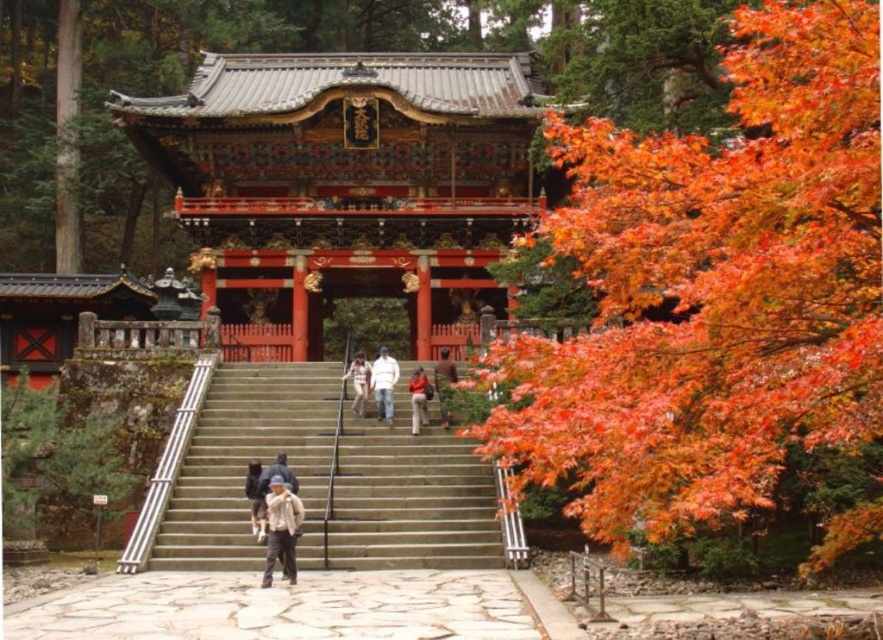
Can you confirm if stone stairs at center is positioned to the right of orange fabric jacket at center?

No, stone stairs at center is not to the right of orange fabric jacket at center.

Can you confirm if stone stairs at center is positioned above orange fabric jacket at center?

No.

Which is behind, point (304, 416) or point (416, 416)?

Point (304, 416)

Find the location of a particular element. The image size is (883, 640). stone stairs at center is located at coordinates (325, 481).

Does dark brown leather jacket at center appear over light brown leather jacket at center?

Indeed, dark brown leather jacket at center is positioned over light brown leather jacket at center.

Who is taller, dark brown leather jacket at center or light brown leather jacket at center?

With more height is dark brown leather jacket at center.

Is point (450, 397) positioned behind point (349, 372)?

That is False.

Find the location of a particular element. The width and height of the screenshot is (883, 640). dark brown leather jacket at center is located at coordinates (444, 385).

Does light beige fabric jacket at lower center appear on the right side of orange fabric jacket at center?

No, light beige fabric jacket at lower center is not to the right of orange fabric jacket at center.

Does point (281, 532) come closer to viewer compared to point (419, 419)?

Yes.

Identify the location of light beige fabric jacket at lower center. Image resolution: width=883 pixels, height=640 pixels. (281, 529).